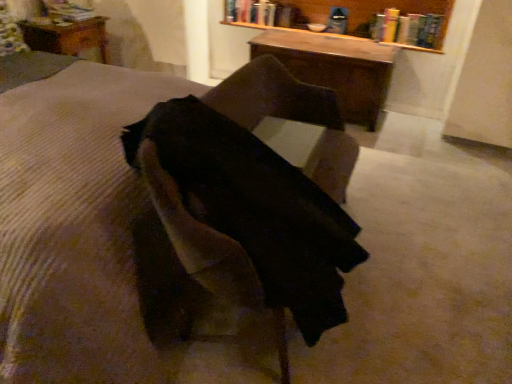
Question: Which direction should I rotate to face hardcover book at upper center, the third book in the left-to-right sequence, — up or down?

Choices:
 (A) up
 (B) down

Answer: (A)

Question: Is wooden bookshelf at upper center shorter than brown corduroy mattress at center?

Choices:
 (A) no
 (B) yes

Answer: (B)

Question: Is wooden bookshelf at upper center wider than brown corduroy mattress at center?

Choices:
 (A) yes
 (B) no

Answer: (B)

Question: Does wooden bookshelf at upper center come in front of brown corduroy mattress at center?

Choices:
 (A) yes
 (B) no

Answer: (B)

Question: Can you confirm if wooden bookshelf at upper center is taller than brown corduroy mattress at center?

Choices:
 (A) no
 (B) yes

Answer: (A)

Question: From a real-world perspective, is wooden bookshelf at upper center located higher than brown corduroy mattress at center?

Choices:
 (A) yes
 (B) no

Answer: (A)

Question: Can you see wooden bookshelf at upper center touching brown corduroy mattress at center?

Choices:
 (A) yes
 (B) no

Answer: (B)

Question: Is wooden bookshelf at upper center a part of wooden table at upper left, acting as the 3th table starting from the front?

Choices:
 (A) no
 (B) yes

Answer: (A)

Question: Does wooden table at upper left, the first table from the back, have a larger size compared to wooden bookshelf at upper center?

Choices:
 (A) yes
 (B) no

Answer: (B)

Question: From the image's perspective, is wooden table at upper left, the first table from the back, over wooden bookshelf at upper center?

Choices:
 (A) yes
 (B) no

Answer: (B)

Question: From the image's perspective, is wooden table at upper left, which appears as the first table when viewed from the left, beneath wooden bookshelf at upper center?

Choices:
 (A) no
 (B) yes

Answer: (B)

Question: Is wooden table at upper left, marked as the 3th table in a right-to-left arrangement, facing away from wooden bookshelf at upper center?

Choices:
 (A) no
 (B) yes

Answer: (A)

Question: Is wooden table at upper left, the first table from the back, aimed at wooden bookshelf at upper center?

Choices:
 (A) no
 (B) yes

Answer: (A)

Question: From a real-world perspective, is suede-like brown chair at center physically above hardcover book at upper center, which ranks as the second book in left-to-right order?

Choices:
 (A) no
 (B) yes

Answer: (A)